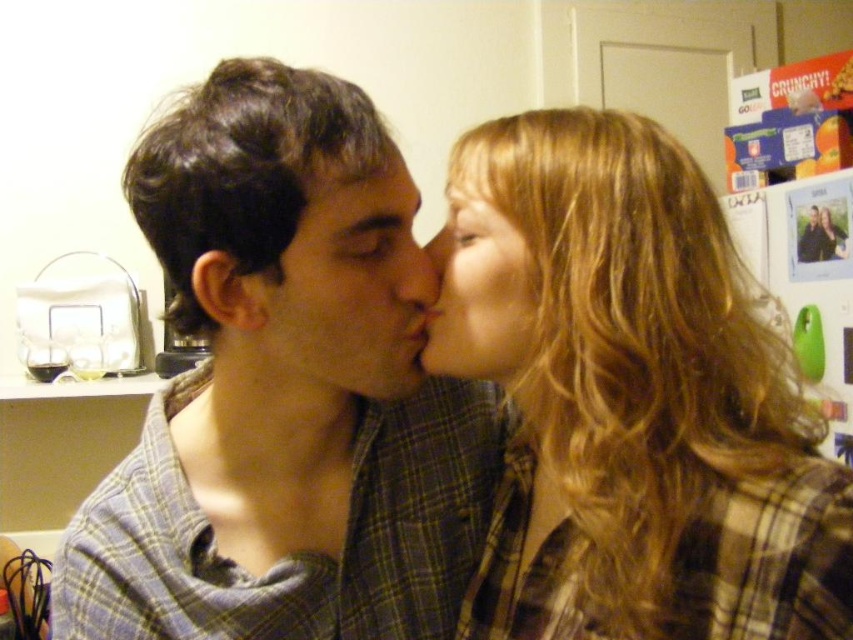
What are the coordinates of the plaid shirt at center?

The plaid shirt at center is located at point (283, 392).

What is the exact location of the matte plaid shirt at center in the image?

The matte plaid shirt at center is located at point [347,291].